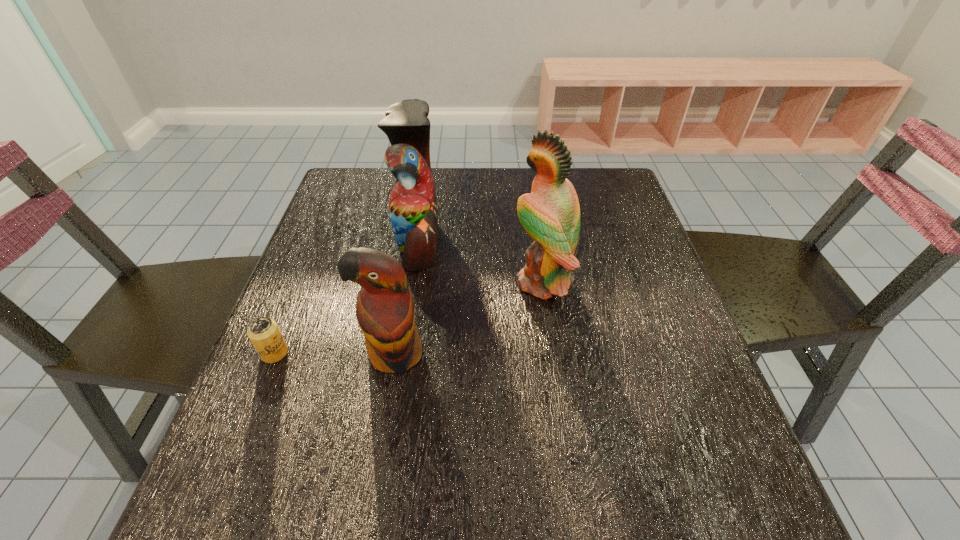
Identify the location of vacant space that is in between the rightmost parrot and the nearest parrot. (468, 318).

Where is `free space between the beer can and the nearest parrot`? free space between the beer can and the nearest parrot is located at coordinates (334, 353).

This screenshot has height=540, width=960. What are the coordinates of `free point between the leftmost object and the nearest parrot` in the screenshot? It's located at (334, 353).

Select which object appears as the third closest to the nearest parrot. Please provide its 2D coordinates. Your answer should be formatted as a tuple, i.e. [(x, y)], where the tuple contains the x and y coordinates of a point satisfying the conditions above.

[(550, 214)]

Identify which object is located as the second nearest to the beer can. Please provide its 2D coordinates. Your answer should be formatted as a tuple, i.e. [(x, y)], where the tuple contains the x and y coordinates of a point satisfying the conditions above.

[(412, 206)]

This screenshot has height=540, width=960. In order to click on parrot identified as the closest to the rightmost object in this screenshot , I will do `click(412, 206)`.

Image resolution: width=960 pixels, height=540 pixels. Identify the location of parrot identified as the second closest to the rightmost parrot. (385, 310).

Locate an element on the screen. The image size is (960, 540). free region that satisfies the following two spatial constraints: 1. on the front-facing side of the rightmost object; 2. on the face of the nearest parrot is located at coordinates (553, 354).

You are a GUI agent. You are given a task and a screenshot of the screen. Output one action in this format:
    pyautogui.click(x=<x>, y=<y>)
    Task: Click on the vacant area in the image that satisfies the following two spatial constraints: 1. on the front-facing side of the rightmost parrot; 2. on the face of the nearest parrot
    
    Given the screenshot: What is the action you would take?
    pyautogui.click(x=553, y=354)

In order to click on blank area in the image that satisfies the following two spatial constraints: 1. on the front-facing side of the rightmost object; 2. on the front side of the shortest object in this screenshot , I will do `click(553, 353)`.